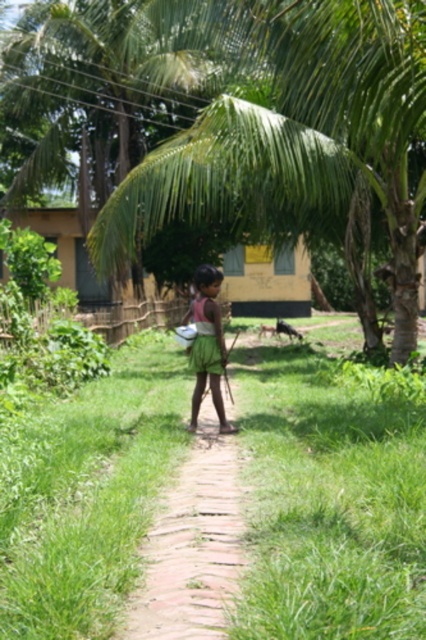
In the scene shown: Does green grass at center have a larger size compared to green fabric skirt at center?

Yes, green grass at center is bigger than green fabric skirt at center.

Does green grass at center have a lesser height compared to green fabric skirt at center?

Correct, green grass at center is not as tall as green fabric skirt at center.

You are a GUI agent. You are given a task and a screenshot of the screen. Output one action in this format:
    pyautogui.click(x=<x>, y=<y>)
    Task: Click on the green grass at center
    The height and width of the screenshot is (640, 426).
    Given the screenshot: What is the action you would take?
    pyautogui.click(x=330, y=502)

Does point (356, 564) come in front of point (402, 262)?

Yes, it is.

Is green grass at center to the left of green leafy coconut tree at center from the viewer's perspective?

In fact, green grass at center is to the right of green leafy coconut tree at center.

This screenshot has width=426, height=640. What do you see at coordinates (330, 502) in the screenshot? I see `green grass at center` at bounding box center [330, 502].

The image size is (426, 640). In order to click on green grass at center in this screenshot , I will do `click(330, 502)`.

Does point (267, 141) come farther from viewer compared to point (195, 394)?

Yes, it is.

Does green leafy coconut tree at center have a smaller size compared to green fabric skirt at center?

Incorrect, green leafy coconut tree at center is not smaller in size than green fabric skirt at center.

Image resolution: width=426 pixels, height=640 pixels. Describe the element at coordinates (287, 124) in the screenshot. I see `green leafy coconut tree at center` at that location.

Where is `green leafy coconut tree at center`? The width and height of the screenshot is (426, 640). green leafy coconut tree at center is located at coordinates (287, 124).